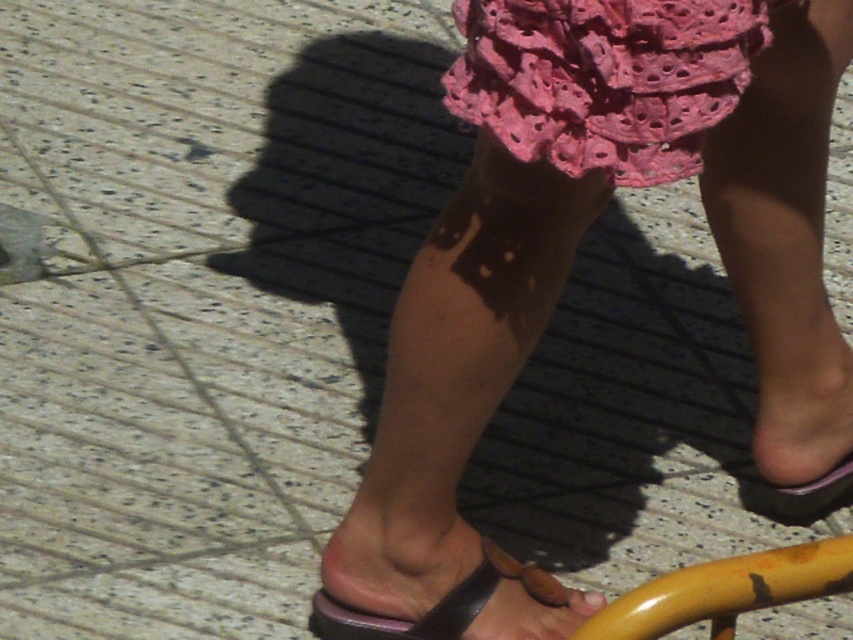
Does pink lace dress at upper center appear under black leather sandal at lower center?

Actually, pink lace dress at upper center is above black leather sandal at lower center.

Looking at this image, who is more forward, (647, 84) or (447, 625)?

Point (647, 84) is more forward.

The image size is (853, 640). Describe the element at coordinates (604, 77) in the screenshot. I see `pink lace dress at upper center` at that location.

The image size is (853, 640). In order to click on pink lace dress at upper center in this screenshot , I will do coord(604,77).